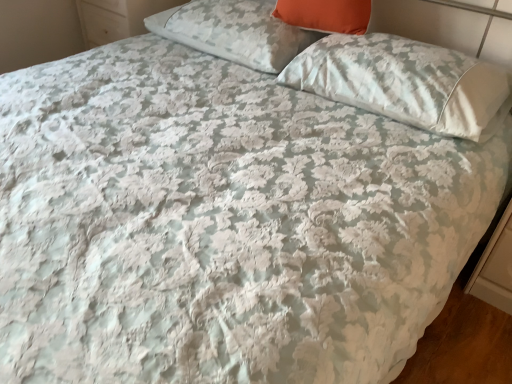
Describe the element at coordinates (405, 82) in the screenshot. I see `white satin pillow at upper right, placed as the 3th pillow when sorted from left to right` at that location.

What do you see at coordinates (325, 15) in the screenshot? Image resolution: width=512 pixels, height=384 pixels. I see `orange fabric pillow at upper center, acting as the 2th pillow starting from the right` at bounding box center [325, 15].

What do you see at coordinates (117, 18) in the screenshot? I see `white glossy dresser at upper left` at bounding box center [117, 18].

At what (x,y) coordinates should I click in order to perform the action: click on white glossy dresser at upper left. Please return your answer as a coordinate pair (x, y). The image size is (512, 384). Looking at the image, I should click on 117,18.

Where is `white satin pillow at upper right, placed as the 3th pillow when sorted from left to right`? This screenshot has height=384, width=512. white satin pillow at upper right, placed as the 3th pillow when sorted from left to right is located at coordinates (405, 82).

Considering the sizes of objects white glossy dresser at upper left and white floral fabric pillow at upper center, marked as the third pillow in a right-to-left arrangement, in the image provided, who is shorter, white glossy dresser at upper left or white floral fabric pillow at upper center, marked as the third pillow in a right-to-left arrangement,?

white floral fabric pillow at upper center, marked as the third pillow in a right-to-left arrangement, is shorter.

Measure the distance from white glossy dresser at upper left to white floral fabric pillow at upper center, the first pillow when ordered from left to right.

A distance of 42.83 centimeters exists between white glossy dresser at upper left and white floral fabric pillow at upper center, the first pillow when ordered from left to right.

From a real-world perspective, between white glossy dresser at upper left and white floral fabric pillow at upper center, marked as the third pillow in a right-to-left arrangement, who is vertically lower?

white glossy dresser at upper left.

Between white glossy dresser at upper left and white floral fabric pillow at upper center, the first pillow when ordered from left to right, which one has larger width?

white glossy dresser at upper left is wider.

Locate an element on the screen. This screenshot has width=512, height=384. dresser lying behind the orange fabric pillow at upper center, acting as the 2th pillow starting from the left is located at coordinates (117, 18).

Who is shorter, orange fabric pillow at upper center, acting as the 2th pillow starting from the left, or white glossy dresser at upper left?

orange fabric pillow at upper center, acting as the 2th pillow starting from the left.

Is orange fabric pillow at upper center, acting as the 2th pillow starting from the right, bigger or smaller than white glossy dresser at upper left?

orange fabric pillow at upper center, acting as the 2th pillow starting from the right, is smaller than white glossy dresser at upper left.

Considering their positions, is orange fabric pillow at upper center, acting as the 2th pillow starting from the left, located in front of or behind white glossy dresser at upper left?

Clearly, orange fabric pillow at upper center, acting as the 2th pillow starting from the left, is in front of white glossy dresser at upper left.

Are white floral fabric pillow at upper center, the first pillow when ordered from left to right, and white satin pillow at upper right, placed as the 3th pillow when sorted from left to right, beside each other?

No, white floral fabric pillow at upper center, the first pillow when ordered from left to right, is not next to white satin pillow at upper right, placed as the 3th pillow when sorted from left to right.

Which of these two, white floral fabric pillow at upper center, the first pillow when ordered from left to right, or white satin pillow at upper right, marked as the 1th pillow in a right-to-left arrangement, is wider?

With larger width is white satin pillow at upper right, marked as the 1th pillow in a right-to-left arrangement.

Is white floral fabric pillow at upper center, marked as the third pillow in a right-to-left arrangement, situated inside white satin pillow at upper right, placed as the 3th pillow when sorted from left to right, or outside?

white floral fabric pillow at upper center, marked as the third pillow in a right-to-left arrangement, is not inside white satin pillow at upper right, placed as the 3th pillow when sorted from left to right, it's outside.

Is point (404, 76) positioned in front of point (80, 20)?

Yes, it is in front of point (80, 20).

Is white satin pillow at upper right, placed as the 3th pillow when sorted from left to right, thinner than white glossy dresser at upper left?

Yes, white satin pillow at upper right, placed as the 3th pillow when sorted from left to right, is thinner than white glossy dresser at upper left.

Considering the sizes of objects white satin pillow at upper right, marked as the 1th pillow in a right-to-left arrangement, and white glossy dresser at upper left in the image provided, who is bigger, white satin pillow at upper right, marked as the 1th pillow in a right-to-left arrangement, or white glossy dresser at upper left?

Result: white glossy dresser at upper left is bigger.

How much distance is there between white satin pillow at upper right, marked as the 1th pillow in a right-to-left arrangement, and white glossy dresser at upper left?

white satin pillow at upper right, marked as the 1th pillow in a right-to-left arrangement, is 3.70 feet from white glossy dresser at upper left.

Which object is thinner, white glossy dresser at upper left or orange fabric pillow at upper center, acting as the 2th pillow starting from the right?

orange fabric pillow at upper center, acting as the 2th pillow starting from the right.

Between white glossy dresser at upper left and orange fabric pillow at upper center, acting as the 2th pillow starting from the right, which one has larger size?

white glossy dresser at upper left.

From the image's perspective, which object appears higher, white glossy dresser at upper left or orange fabric pillow at upper center, acting as the 2th pillow starting from the right?

white glossy dresser at upper left appears higher in the image.

From the image's perspective, relative to orange fabric pillow at upper center, acting as the 2th pillow starting from the right, is white floral fabric pillow at upper center, the first pillow when ordered from left to right, above or below?

Based on their image positions, white floral fabric pillow at upper center, the first pillow when ordered from left to right, is located above orange fabric pillow at upper center, acting as the 2th pillow starting from the right.

Which is more to the right, white floral fabric pillow at upper center, marked as the third pillow in a right-to-left arrangement, or orange fabric pillow at upper center, acting as the 2th pillow starting from the left?

orange fabric pillow at upper center, acting as the 2th pillow starting from the left, is more to the right.

Can you confirm if white floral fabric pillow at upper center, the first pillow when ordered from left to right, is bigger than orange fabric pillow at upper center, acting as the 2th pillow starting from the left?

Yes.

Which of these two, white floral fabric pillow at upper center, the first pillow when ordered from left to right, or white glossy dresser at upper left, is wider?

white glossy dresser at upper left is wider.

Is point (270, 14) farther from camera compared to point (104, 42)?

No, (270, 14) is in front of (104, 42).

Which object is positioned more to the right, white floral fabric pillow at upper center, marked as the third pillow in a right-to-left arrangement, or white glossy dresser at upper left?

white floral fabric pillow at upper center, marked as the third pillow in a right-to-left arrangement, is more to the right.

In the scene shown: From a real-world perspective, is white floral fabric pillow at upper center, the first pillow when ordered from left to right, located higher than white glossy dresser at upper left?

Indeed, from a real-world perspective, white floral fabric pillow at upper center, the first pillow when ordered from left to right, stands above white glossy dresser at upper left.

From the white glossy dresser at upper left, count 1st pillows forward and point to it. Please provide its 2D coordinates.

[(234, 32)]

From the image's perspective, starting from the white glossy dresser at upper left, which pillow is the 2nd one below? Please provide its 2D coordinates.

[(325, 15)]

Consider the image. From the image, which object appears to be nearer to orange fabric pillow at upper center, acting as the 2th pillow starting from the right, white satin pillow at upper right, placed as the 3th pillow when sorted from left to right, or white floral fabric pillow at upper center, marked as the third pillow in a right-to-left arrangement?

The object closer to orange fabric pillow at upper center, acting as the 2th pillow starting from the right, is white floral fabric pillow at upper center, marked as the third pillow in a right-to-left arrangement.

From the image, which object appears to be farther from white glossy dresser at upper left, orange fabric pillow at upper center, acting as the 2th pillow starting from the left, or white satin pillow at upper right, marked as the 1th pillow in a right-to-left arrangement?

The object further to white glossy dresser at upper left is white satin pillow at upper right, marked as the 1th pillow in a right-to-left arrangement.

Based on the photo, looking at the image, which one is located further to white glossy dresser at upper left, white floral fabric pillow at upper center, the first pillow when ordered from left to right, or orange fabric pillow at upper center, acting as the 2th pillow starting from the right?

orange fabric pillow at upper center, acting as the 2th pillow starting from the right.

Consider the image. From the image, which object appears to be farther from orange fabric pillow at upper center, acting as the 2th pillow starting from the left, white floral fabric pillow at upper center, marked as the third pillow in a right-to-left arrangement, or white glossy dresser at upper left?

white glossy dresser at upper left.

From the image, which object appears to be farther from white floral fabric pillow at upper center, marked as the third pillow in a right-to-left arrangement, white satin pillow at upper right, marked as the 1th pillow in a right-to-left arrangement, or orange fabric pillow at upper center, acting as the 2th pillow starting from the left?

Among the two, white satin pillow at upper right, marked as the 1th pillow in a right-to-left arrangement, is located further to white floral fabric pillow at upper center, marked as the third pillow in a right-to-left arrangement.

Estimate the real-world distances between objects in this image. Which object is closer to white satin pillow at upper right, placed as the 3th pillow when sorted from left to right, white floral fabric pillow at upper center, marked as the third pillow in a right-to-left arrangement, or white glossy dresser at upper left?

white floral fabric pillow at upper center, marked as the third pillow in a right-to-left arrangement.

Looking at this image, based on their spatial positions, is white floral fabric pillow at upper center, the first pillow when ordered from left to right, or white satin pillow at upper right, placed as the 3th pillow when sorted from left to right, further from orange fabric pillow at upper center, acting as the 2th pillow starting from the left?

Among the two, white satin pillow at upper right, placed as the 3th pillow when sorted from left to right, is located further to orange fabric pillow at upper center, acting as the 2th pillow starting from the left.

When comparing their distances from white satin pillow at upper right, placed as the 3th pillow when sorted from left to right, does orange fabric pillow at upper center, acting as the 2th pillow starting from the left, or white glossy dresser at upper left seem closer?

Based on the image, orange fabric pillow at upper center, acting as the 2th pillow starting from the left, appears to be nearer to white satin pillow at upper right, placed as the 3th pillow when sorted from left to right.

Locate an element on the screen. pillow between white glossy dresser at upper left and orange fabric pillow at upper center, acting as the 2th pillow starting from the left, in the horizontal direction is located at coordinates (234, 32).

In order to click on pillow located between white floral fabric pillow at upper center, marked as the third pillow in a right-to-left arrangement, and white satin pillow at upper right, marked as the 1th pillow in a right-to-left arrangement, in the left-right direction in this screenshot , I will do `click(325, 15)`.